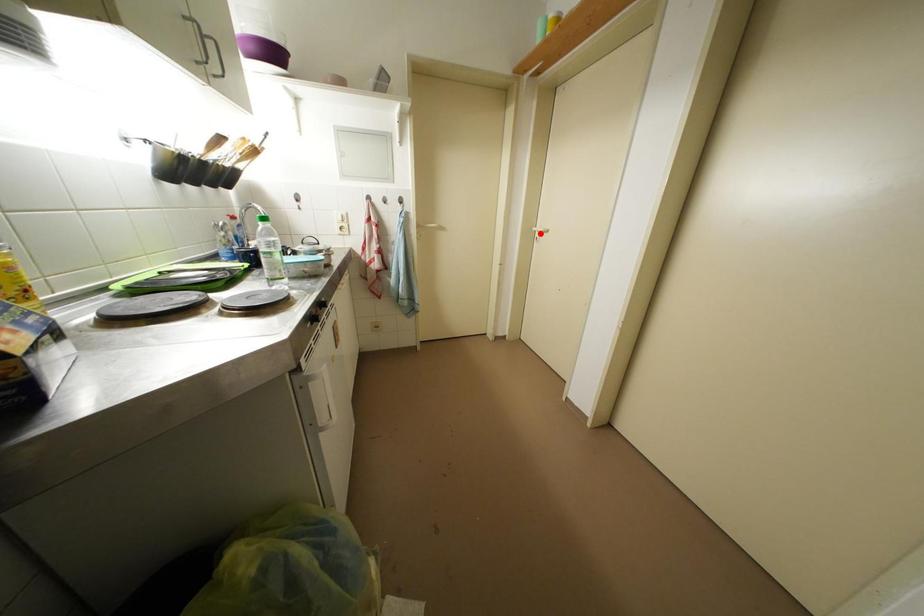
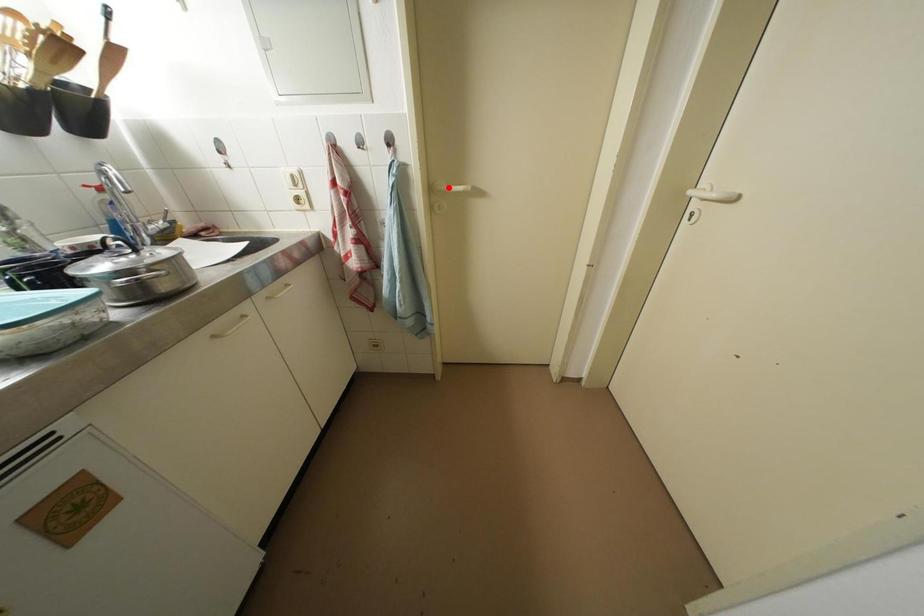
I am providing you with two images of the same scene from different viewpoints. A red point is marked on the first image and another point is marked on the second image. Do the highlighted points in image1 and image2 indicate the same real-world spot?

No